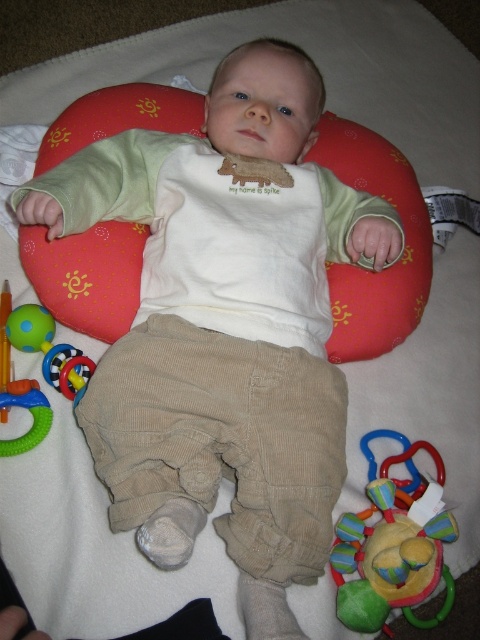
Question: Estimate the real-world distances between objects in this image. Which object is closer to the multicolored fabric rattle at lower right?

Choices:
 (A) red fabric bean bag chair at center
 (B) rubberized plastic rattle at lower left

Answer: (B)

Question: Is multicolored fabric rattle at lower right to the right of rubberized plastic rattle at lower left from the viewer's perspective?

Choices:
 (A) yes
 (B) no

Answer: (A)

Question: Which object appears closest to the camera in this image?

Choices:
 (A) red fabric bean bag chair at center
 (B) multicolored fabric rattle at lower right
 (C) rubberized plastic rattle at lower left

Answer: (B)

Question: Where is red fabric bean bag chair at center located in relation to rubberized plastic rattle at lower left in the image?

Choices:
 (A) right
 (B) left

Answer: (A)

Question: From the image, what is the correct spatial relationship of red fabric bean bag chair at center in relation to multicolored fabric rattle at lower right?

Choices:
 (A) left
 (B) right

Answer: (A)

Question: Among these objects, which one is farthest from the camera?

Choices:
 (A) rubberized plastic rattle at lower left
 (B) red fabric bean bag chair at center
 (C) multicolored fabric rattle at lower right

Answer: (B)